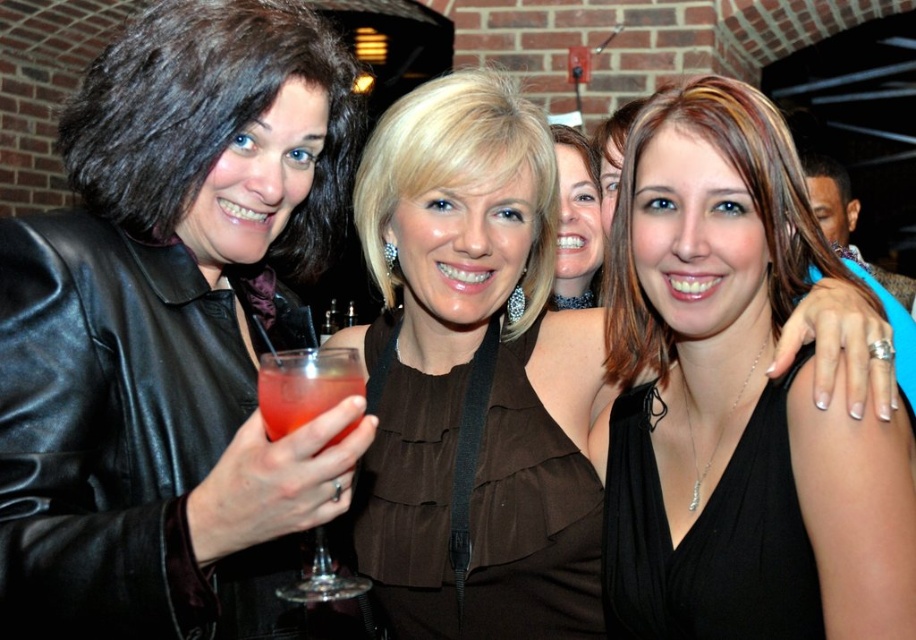
You are a bartender trying to reach the translucent glass at left for a customer. Is the black leather jacket at left blocking your access to it?

The black leather jacket at left is positioned over the translucent glass at left, so it is blocking access to the glass.

You are a photographer at the event and want to capture a photo of the black satin dress at center and the matte brown blouse at center. Which one will appear larger in the photo?

The black satin dress at center will appear larger in the photo because it is much taller than the matte brown blouse at center.